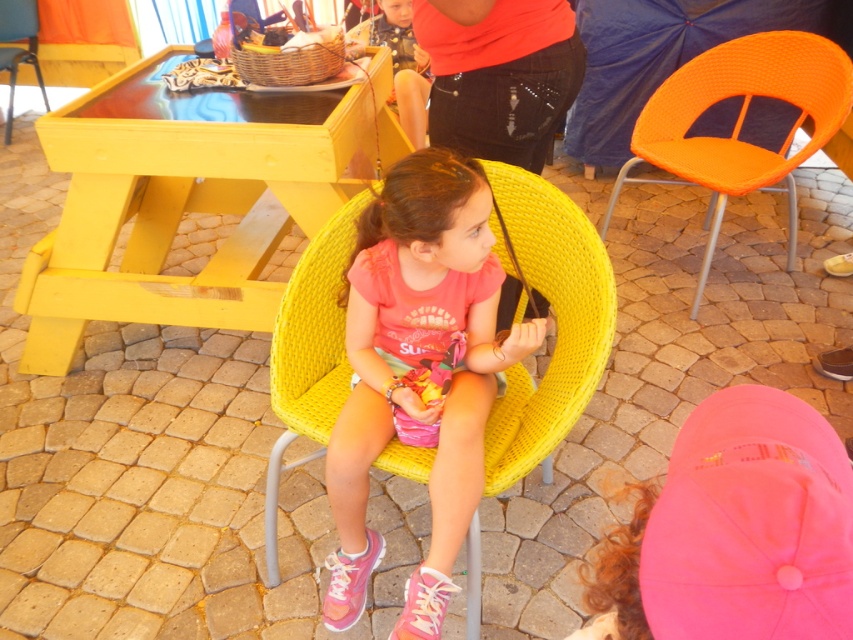
You are standing at the center of the paved area and want to place a new orange woven chair at upper right exactly where the existing one is located. What are the coordinates of the spot where you should place it?

The coordinates for the orange woven chair at upper right are 0.192 on the x axis and 0.868 on the y axis.

You are standing in the middle of the paved area and want to place a small potted plant between the orange woven chair at upper right and the orange woven umbrella at upper right. Based on their positions, which object should the plant be closer to?

The orange woven chair at upper right is closer to the viewer than the orange woven umbrella at upper right, so the potted plant should be placed closer to the orange woven umbrella at upper right to maintain equal distance between both objects.

You are organizing a small event and need to place a pink fabric cap at lower right and a yellow woven chair at upper left. Considering their sizes, which object should you place first to ensure proper spacing?

The pink fabric cap at lower right should be placed first since it has a larger size compared to the yellow woven chair at upper left, allowing for adequate spacing between them.